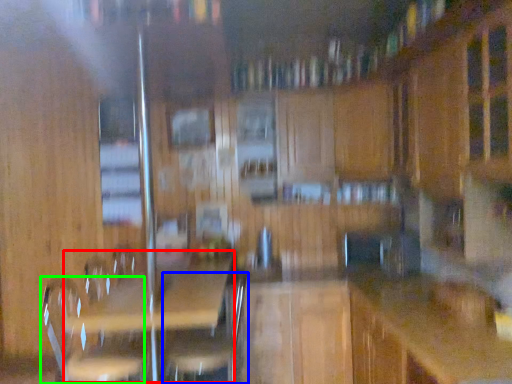
Question: Which object is the closest to the picnic table (highlighted by a red box)? Choose among these: swivel chair (highlighted by a blue box) or swivel chair (highlighted by a green box).

Choices:
 (A) swivel chair
 (B) swivel chair

Answer: (A)